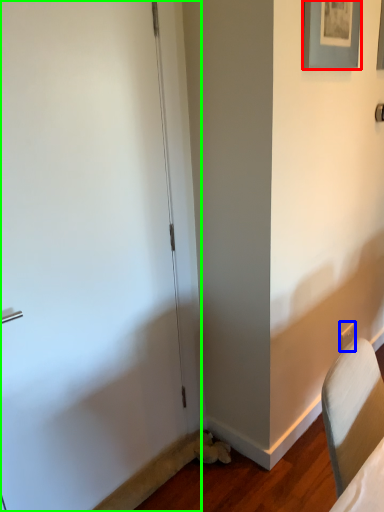
Question: Which object is the farthest from picture frame (highlighted by a red box)? Choose among these: electric outlet (highlighted by a blue box) or door (highlighted by a green box).

Choices:
 (A) electric outlet
 (B) door

Answer: (A)